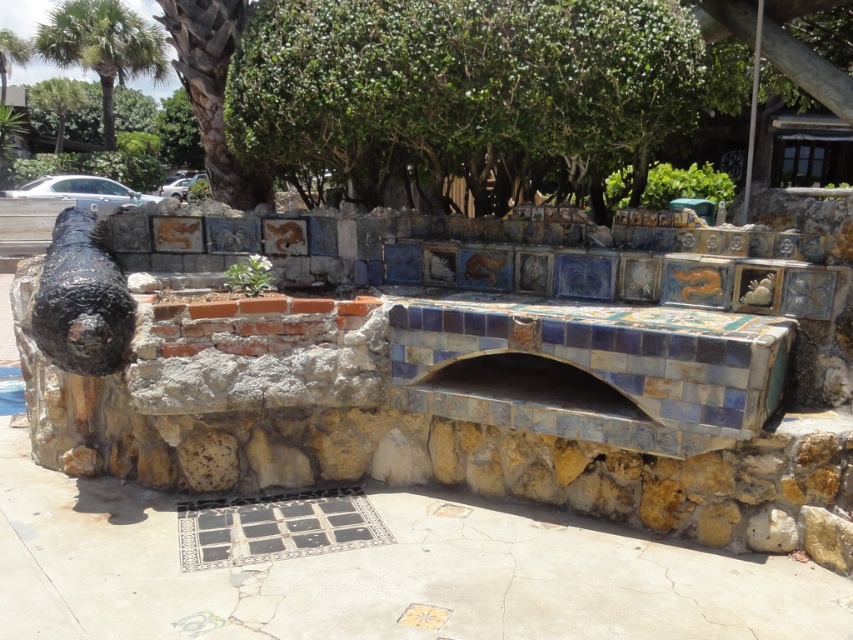
This screenshot has height=640, width=853. What do you see at coordinates (80, 300) in the screenshot? I see `rusty metal cannon at left` at bounding box center [80, 300].

Is the position of rusty metal cannon at left less distant than that of green leafy palm tree at upper left?

Yes, it is in front of green leafy palm tree at upper left.

The height and width of the screenshot is (640, 853). Identify the location of rusty metal cannon at left. (80, 300).

Locate an element on the screen. This screenshot has height=640, width=853. rusty metal cannon at left is located at coordinates (80, 300).

Does rusty metal cannon at left appear over matte ceramic hand at center-right?

→ Yes, rusty metal cannon at left is above matte ceramic hand at center-right.

In the scene shown: Who is lower down, rusty metal cannon at left or matte ceramic hand at center-right?

matte ceramic hand at center-right is below.

Is point (65, 212) more distant than point (762, 294)?

Yes, point (65, 212) is behind point (762, 294).

Where is `rusty metal cannon at left`? rusty metal cannon at left is located at coordinates (80, 300).

In the scene shown: Between green leafy palm tree at upper left and matte ceramic hand at center-right, which one is positioned lower?

Positioned lower is matte ceramic hand at center-right.

Can you confirm if green leafy palm tree at upper left is taller than matte ceramic hand at center-right?

Yes.

Where is `green leafy palm tree at upper left`? The height and width of the screenshot is (640, 853). green leafy palm tree at upper left is located at coordinates (102, 45).